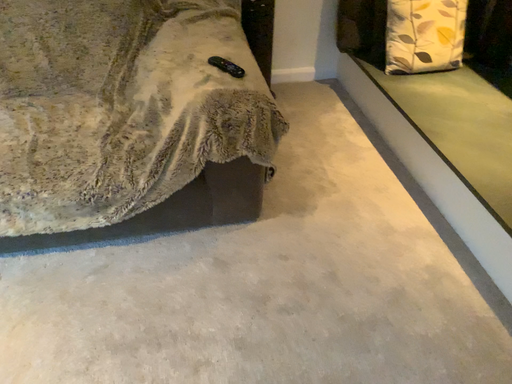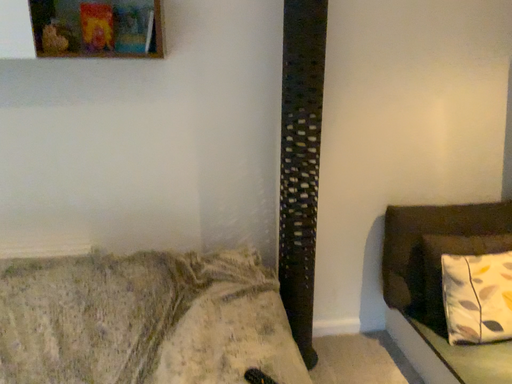
Question: How did the camera likely rotate when shooting the video?

Choices:
 (A) rotated upward
 (B) rotated downward

Answer: (A)